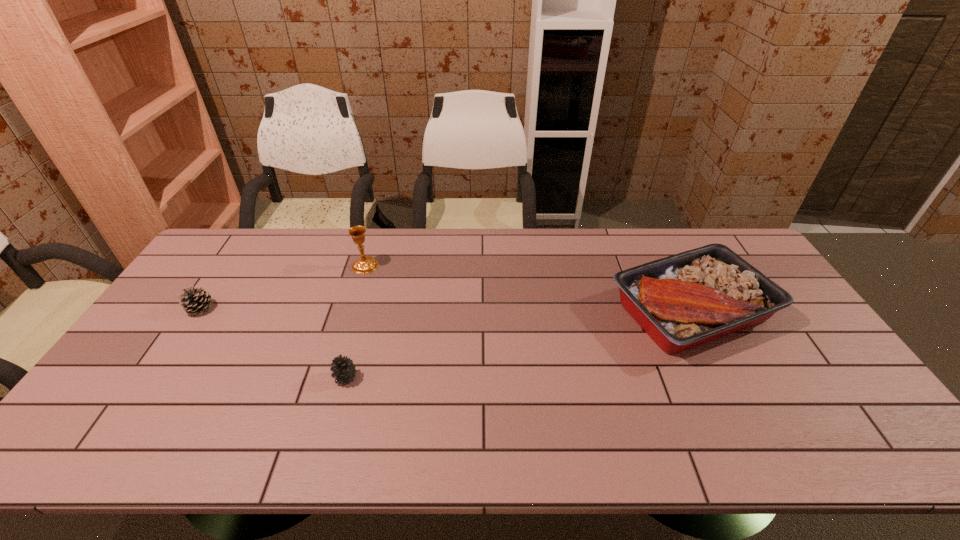
Where is `empty space that is in between the chalice and the nearest object`? empty space that is in between the chalice and the nearest object is located at coordinates (355, 322).

Locate an element on the screen. vacant area that lies between the second tallest object and the chalice is located at coordinates (528, 288).

Image resolution: width=960 pixels, height=540 pixels. What are the coordinates of `free space between the third shortest object and the farther pinecone` in the screenshot? It's located at (445, 310).

Where is `vacant space in between the farther pinecone and the nearer pinecone`? This screenshot has height=540, width=960. vacant space in between the farther pinecone and the nearer pinecone is located at coordinates (273, 343).

Identify the location of vacant area that lies between the right pinecone and the tray. (518, 345).

Where is `empty space that is in between the right pinecone and the farther pinecone`? Image resolution: width=960 pixels, height=540 pixels. empty space that is in between the right pinecone and the farther pinecone is located at coordinates (273, 343).

The width and height of the screenshot is (960, 540). What are the coordinates of `empty location between the nearest object and the tray` in the screenshot? It's located at (518, 345).

Find the location of a particular element. vacant area that lies between the chalice and the rightmost object is located at coordinates (528, 288).

Locate an element on the screen. This screenshot has height=540, width=960. free space that is in between the third shortest object and the tallest object is located at coordinates (528, 288).

Where is `unoccupied area between the rightmost object and the nearer pinecone`? The image size is (960, 540). unoccupied area between the rightmost object and the nearer pinecone is located at coordinates (518, 345).